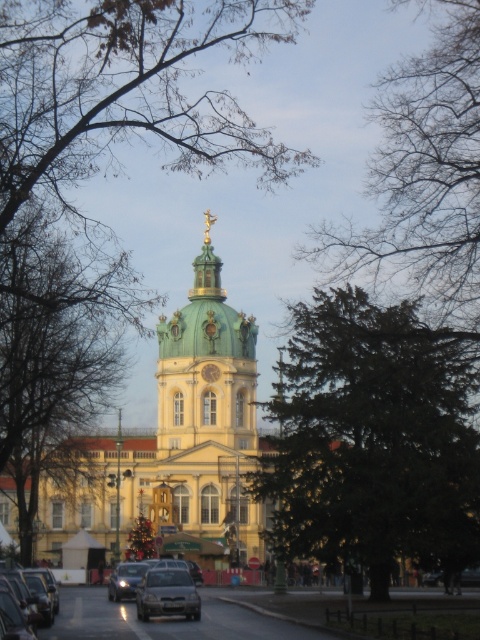
Which is more to the right, matte silver sedan at center or metallic silver car at center?

matte silver sedan at center is more to the right.

Can you confirm if matte silver sedan at center is taller than metallic silver car at center?

No, matte silver sedan at center is not taller than metallic silver car at center.

I want to click on matte silver sedan at center, so click(x=167, y=595).

Can you confirm if green leafy tree at center is bigger than matte black car at lower left?

Correct, green leafy tree at center is larger in size than matte black car at lower left.

Is green leafy tree at center thinner than matte black car at lower left?

No, green leafy tree at center is not thinner than matte black car at lower left.

This screenshot has height=640, width=480. Find the location of `green leafy tree at center`. green leafy tree at center is located at coordinates (55, 344).

Does green matte dome at center appear under gold metallic clock at center?

Incorrect, green matte dome at center is not positioned below gold metallic clock at center.

Is green matte dome at center closer to the viewer compared to gold metallic clock at center?

Yes, green matte dome at center is in front of gold metallic clock at center.

Is point (196, 314) positioned after point (205, 369)?

Yes, point (196, 314) is behind point (205, 369).

Locate an element on the screen. The height and width of the screenshot is (640, 480). green matte dome at center is located at coordinates (204, 364).